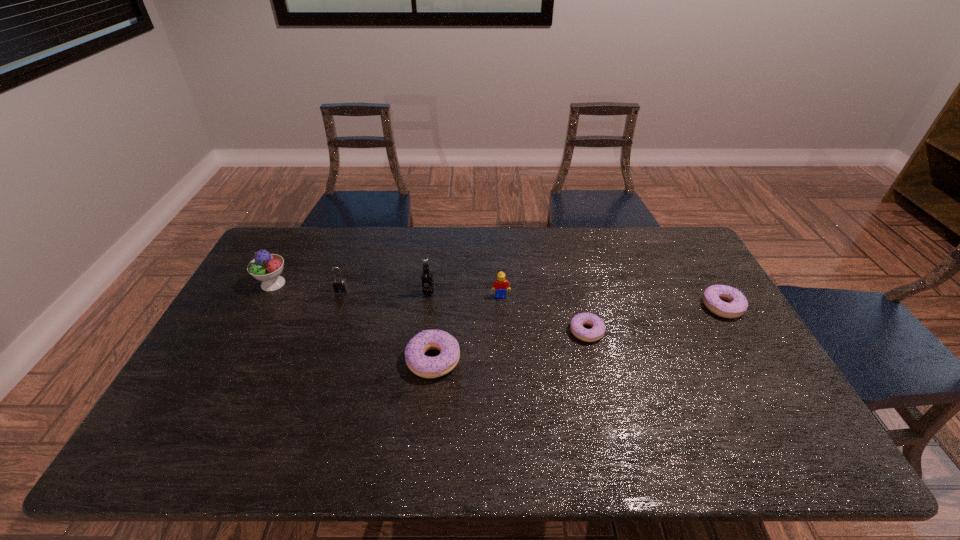
Observe the arrangement of all doughnuts in the image. To keep them evenly spaced, where would you place another doughnut on the left? Please locate a free space. Please provide its 2D coordinates. Your answer should be formatted as a tuple, i.e. [(x, y)], where the tuple contains the x and y coordinates of a point satisfying the conditions above.

[(259, 392)]